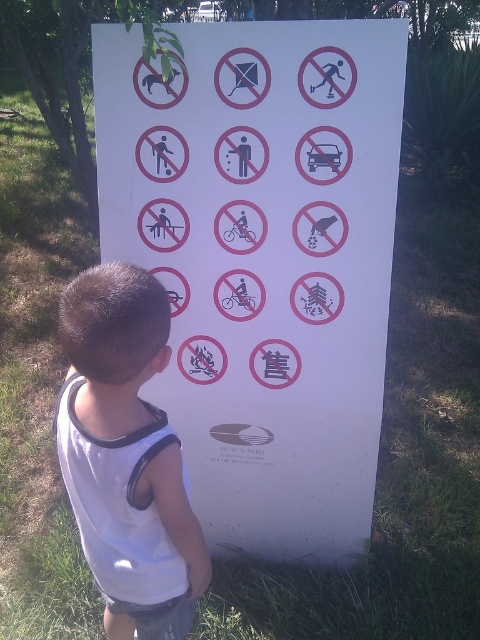
Question: Does white paper sign at center have a larger size compared to white fabric shirt at center?

Choices:
 (A) no
 (B) yes

Answer: (B)

Question: From the image, what is the correct spatial relationship of white paper sign at center in relation to white fabric shirt at center?

Choices:
 (A) below
 (B) above

Answer: (B)

Question: Is white paper sign at center wider than white fabric shirt at center?

Choices:
 (A) no
 (B) yes

Answer: (B)